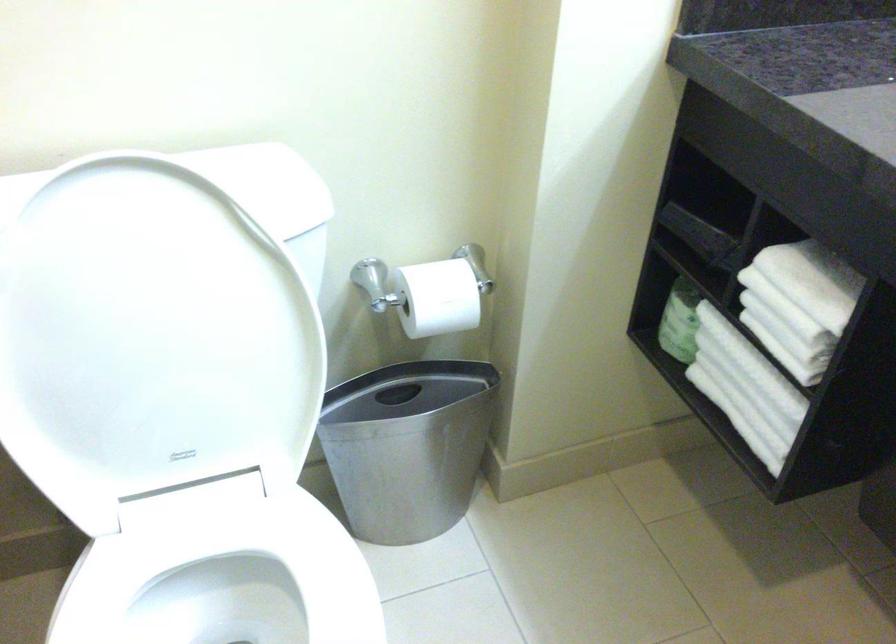
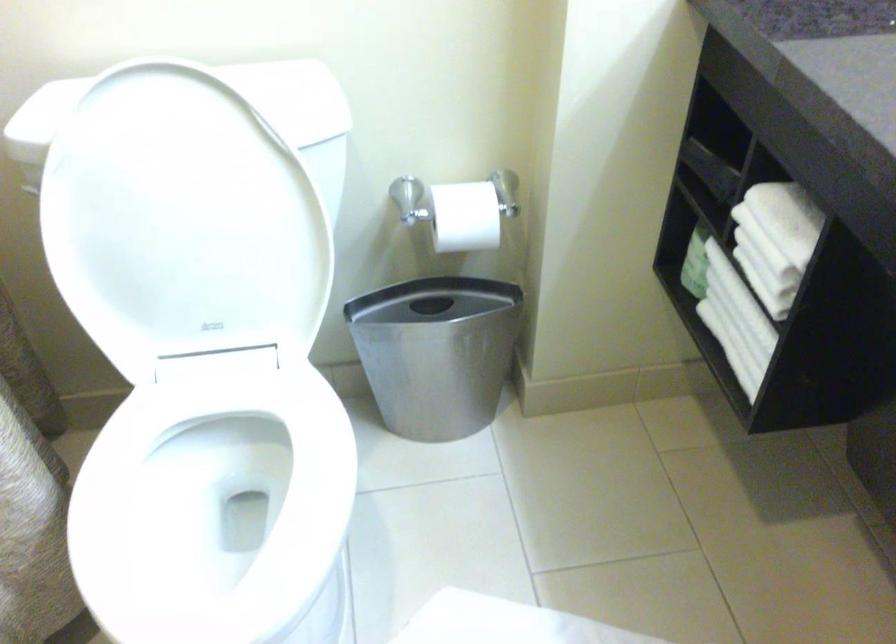
What movement of the cameraman would produce the second image?

The cameraman walked toward right, backward.